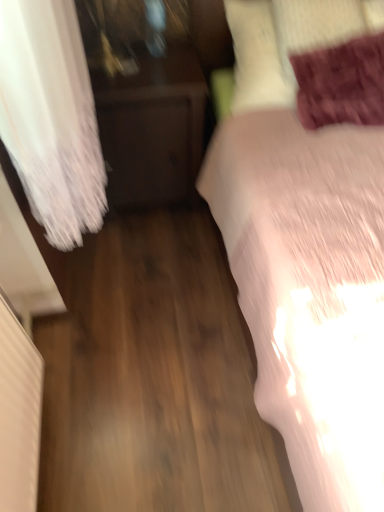
Question: Does dark wood nightstand at left appear on the right side of white soft bed at right?

Choices:
 (A) yes
 (B) no

Answer: (B)

Question: Does dark wood nightstand at left have a smaller size compared to white soft bed at right?

Choices:
 (A) yes
 (B) no

Answer: (A)

Question: Is the position of dark wood nightstand at left more distant than that of white soft bed at right?

Choices:
 (A) no
 (B) yes

Answer: (B)

Question: Is dark wood nightstand at left positioned far away from white soft bed at right?

Choices:
 (A) yes
 (B) no

Answer: (B)

Question: Is dark wood nightstand at left oriented away from white soft bed at right?

Choices:
 (A) no
 (B) yes

Answer: (A)

Question: Is dark wood nightstand at left facing towards white soft bed at right?

Choices:
 (A) yes
 (B) no

Answer: (B)

Question: Is white soft bed at right to the left of velvet purple pillow at upper right from the viewer's perspective?

Choices:
 (A) yes
 (B) no

Answer: (B)

Question: Are white soft bed at right and velvet purple pillow at upper right located far from each other?

Choices:
 (A) yes
 (B) no

Answer: (B)

Question: Is white soft bed at right beside velvet purple pillow at upper right?

Choices:
 (A) no
 (B) yes

Answer: (A)

Question: Is the depth of white soft bed at right greater than that of velvet purple pillow at upper right?

Choices:
 (A) yes
 (B) no

Answer: (B)

Question: From a real-world perspective, is white soft bed at right physically below velvet purple pillow at upper right?

Choices:
 (A) yes
 (B) no

Answer: (A)

Question: Is white soft bed at right shorter than velvet purple pillow at upper right?

Choices:
 (A) yes
 (B) no

Answer: (B)

Question: Is white soft bed at right taller than dark wood nightstand at left?

Choices:
 (A) yes
 (B) no

Answer: (A)